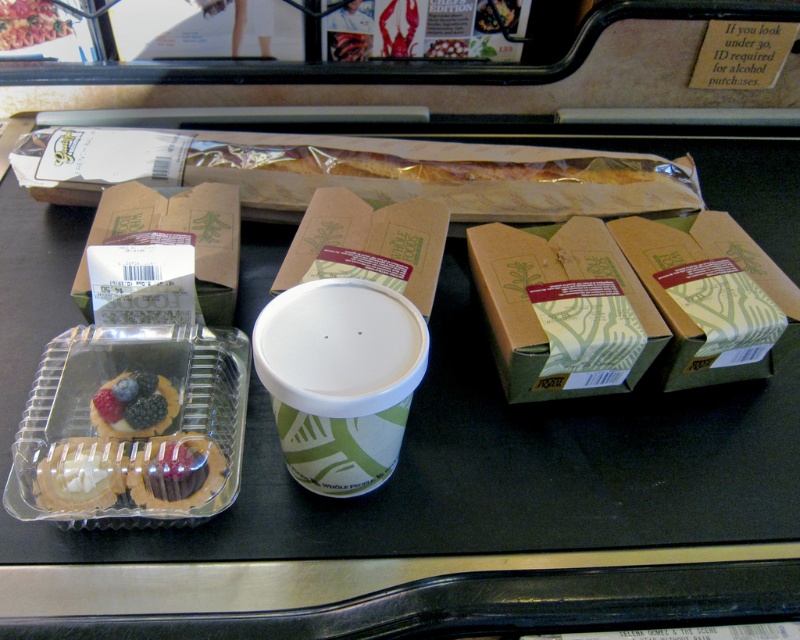
You are a customer at the checkout counter and want to stack the brown cardboard box at center on top of the brown cardboard box at right. Is this possible without the bottom box being crushed?

The brown cardboard box at center has a lesser height compared to the brown cardboard box at right, so stacking the shorter box on top of the taller one would not crush the bottom box. It is possible to stack them safely.

You are at the checkout counter and need to place the chocolate frosted cupcake at lower left into a box that can only hold items within a 0.1 unit radius from its current position. Is the cupcake within the required area?

The chocolate frosted cupcake at lower left is located at point [176,472]. Since the box can only hold items within a 0.1 unit radius from its current position, the cupcake is within the required area as its coordinates fall within that radius.